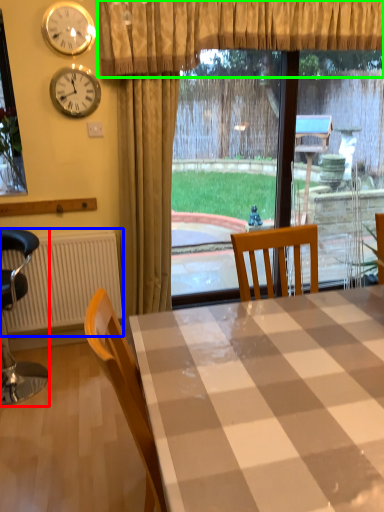
Question: Considering the real-world distances, which object is closest to chair (highlighted by a red box)? radiator (highlighted by a blue box) or curtain (highlighted by a green box).

Choices:
 (A) radiator
 (B) curtain

Answer: (A)